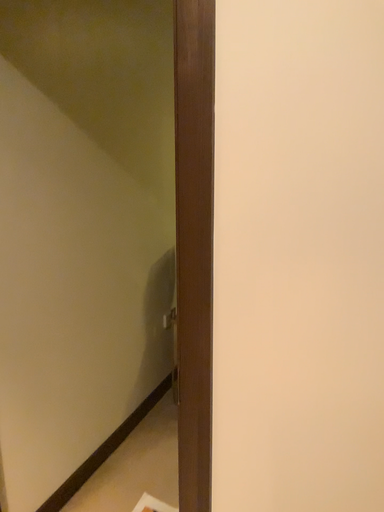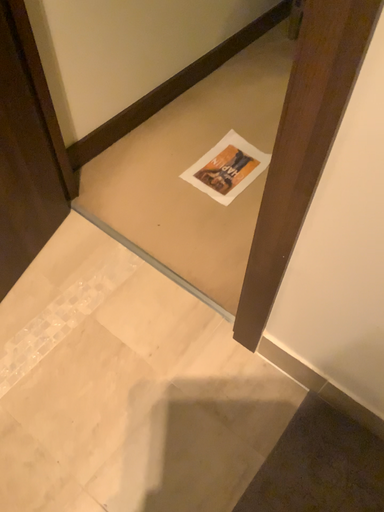
Question: Which way did the camera rotate in the video?

Choices:
 (A) rotated downward
 (B) rotated upward

Answer: (A)